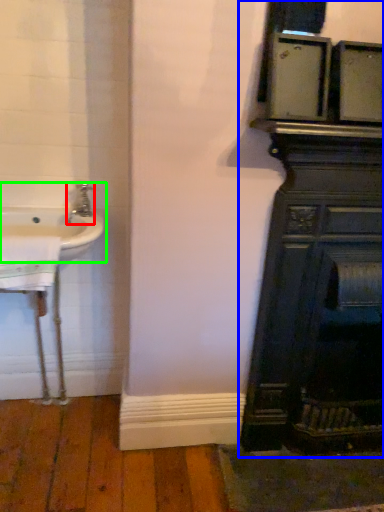
Question: Which object is the farthest from tap (highlighted by a red box)? Choose among these: bathroom cabinet (highlighted by a blue box) or sink (highlighted by a green box).

Choices:
 (A) bathroom cabinet
 (B) sink

Answer: (A)